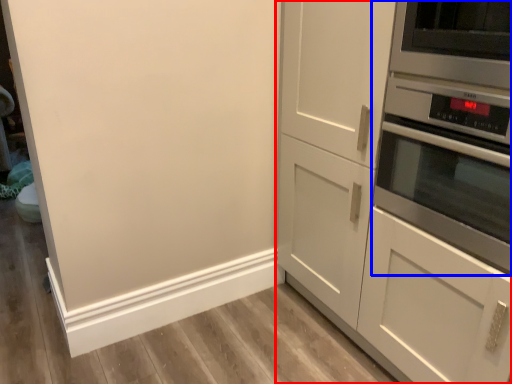
Question: Which object is closer to the camera taking this photo, cabinetry (highlighted by a red box) or home appliance (highlighted by a blue box)?

Choices:
 (A) cabinetry
 (B) home appliance

Answer: (A)